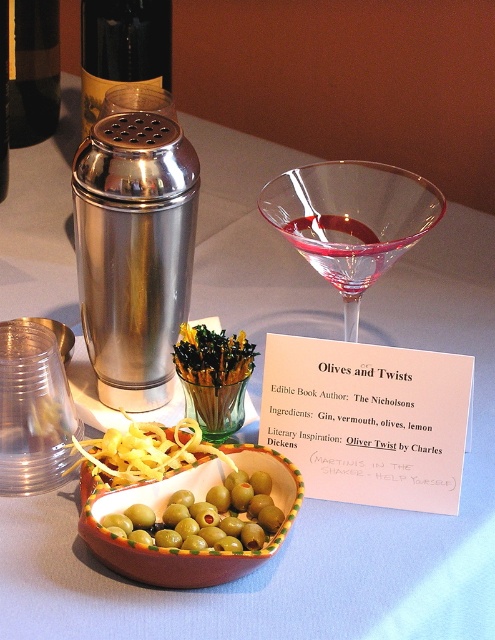
Is shiny metallic shaker at center-left closer to the viewer compared to transparent glass martini at center?

Yes, it is.

Between shiny metallic shaker at center-left and transparent glass martini at center, which one has less height?

transparent glass martini at center is shorter.

Between point (178, 198) and point (401, 234), which one is positioned in front?

Positioned in front is point (178, 198).

In order to click on shiny metallic shaker at center-left in this screenshot , I will do `click(134, 252)`.

Who is taller, shiny metallic shaker at center-left or shiny dark bottle at upper left?

Standing taller between the two is shiny metallic shaker at center-left.

How distant is shiny metallic shaker at center-left from shiny dark bottle at upper left?

A distance of 56.88 centimeters exists between shiny metallic shaker at center-left and shiny dark bottle at upper left.

Is point (198, 173) positioned behind point (55, 90)?

No, (198, 173) is in front of (55, 90).

You are a GUI agent. You are given a task and a screenshot of the screen. Output one action in this format:
    pyautogui.click(x=<x>, y=<y>)
    Task: Click on the shiny metallic shaker at center-left
    This screenshot has height=640, width=495.
    Given the screenshot: What is the action you would take?
    (x=134, y=252)

Does transparent glass martini at center have a greater height compared to brushed metal shaker at upper left?

Yes.

Measure the distance between transparent glass martini at center and camera.

transparent glass martini at center is 20.72 inches from camera.

What do you see at coordinates (350, 220) in the screenshot?
I see `transparent glass martini at center` at bounding box center [350, 220].

Locate an element on the screen. Image resolution: width=495 pixels, height=640 pixels. transparent glass martini at center is located at coordinates (350, 220).